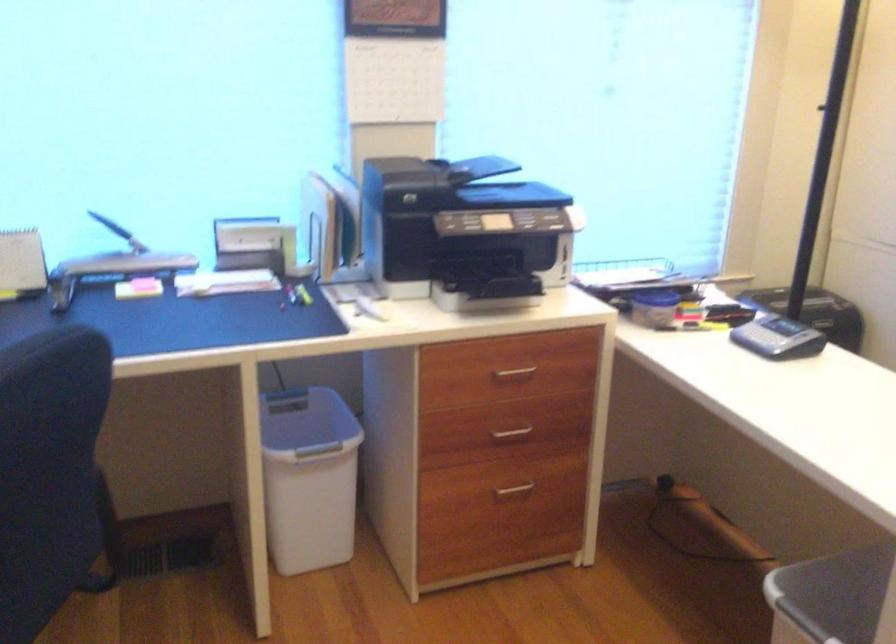
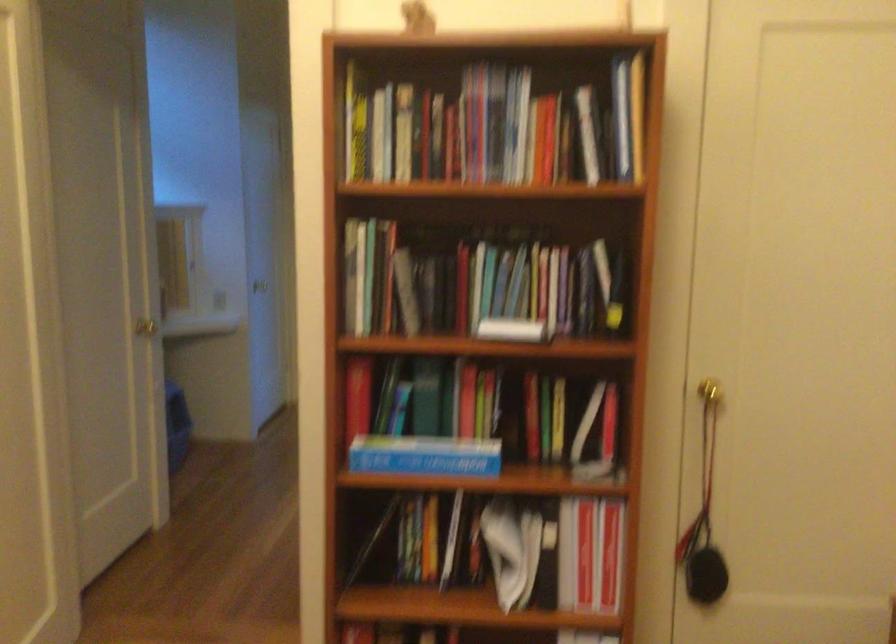
Question: Based on the continuous images, in which direction is the camera rotating? Reply with the corresponding letter.

Choices:
 (A) Left
 (B) Right
 (C) Up
 (D) Down

Answer: (B)